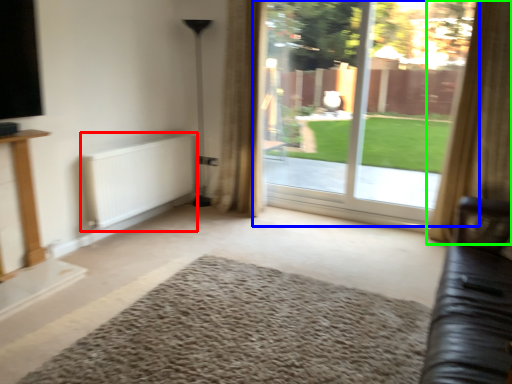
Question: Which is farther away from radiator (highlighted by a red box)? window (highlighted by a blue box) or curtain (highlighted by a green box)?

Choices:
 (A) window
 (B) curtain

Answer: (B)